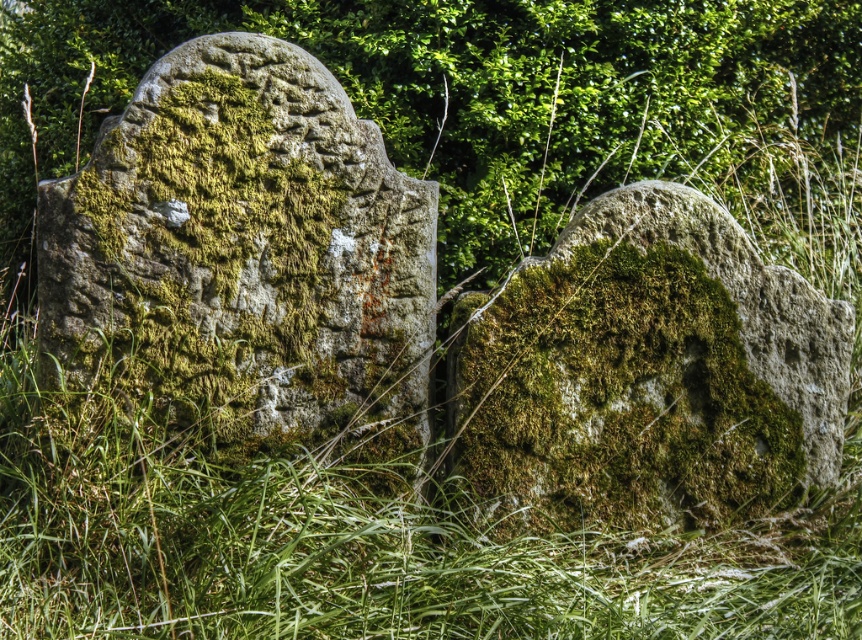
Question: Among these objects, which one is farthest from the camera?

Choices:
 (A) green mossy stone at left
 (B) green mossy stone at center

Answer: (B)

Question: Which point appears closest to the camera in this image?

Choices:
 (A) coord(92,10)
 (B) coord(523,272)

Answer: (B)

Question: In this image, where is green mossy stone at left located relative to green mossy stone at center?

Choices:
 (A) below
 (B) above

Answer: (B)

Question: Does green mossy stone at left lie behind green mossy stone at center?

Choices:
 (A) yes
 (B) no

Answer: (B)

Question: Considering the real-world distances, which object is farthest from the green mossy stone at upper center?

Choices:
 (A) green mossy stone at left
 (B) green mossy stone at center

Answer: (A)

Question: Can you confirm if green mossy stone at upper center is thinner than green mossy stone at left?

Choices:
 (A) no
 (B) yes

Answer: (A)